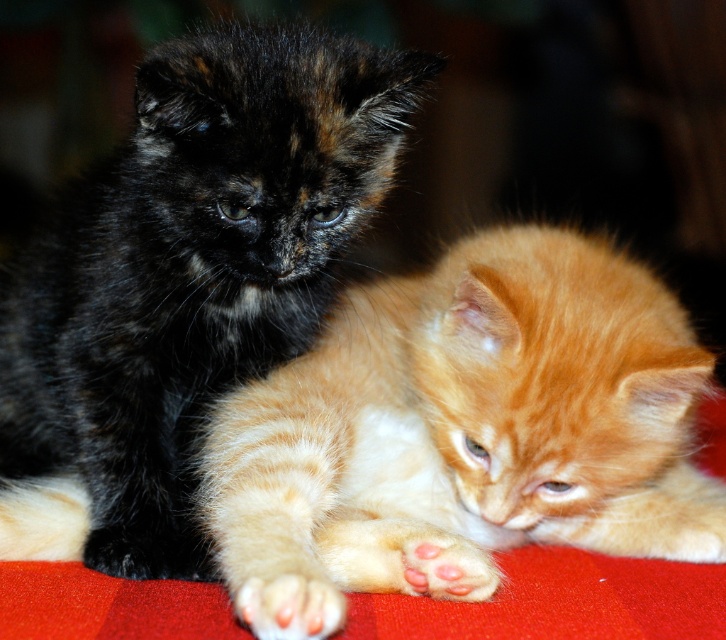
You are a cat owner who wants to ensure both kittens have enough space to sleep comfortably. Given that the black fur kitten at left is larger, will the white soft fur paw at lower left need to be moved to make more room?

The black fur kitten at left is bigger than the white soft fur paw at lower left, so the white soft fur paw at lower left does not need to be moved because it is smaller and already has sufficient space.

You are a cat owner who wants to pet the orange tabby kitten at center. If your hand is 36 inches away from the kitten, can you reach it without moving your body?

The orange tabby kitten at center and the viewer are 37.60 inches apart. Since your hand is 36 inches away from the kitten, you cannot reach it without moving your body because the distance between you and the kitten is greater than your reach.